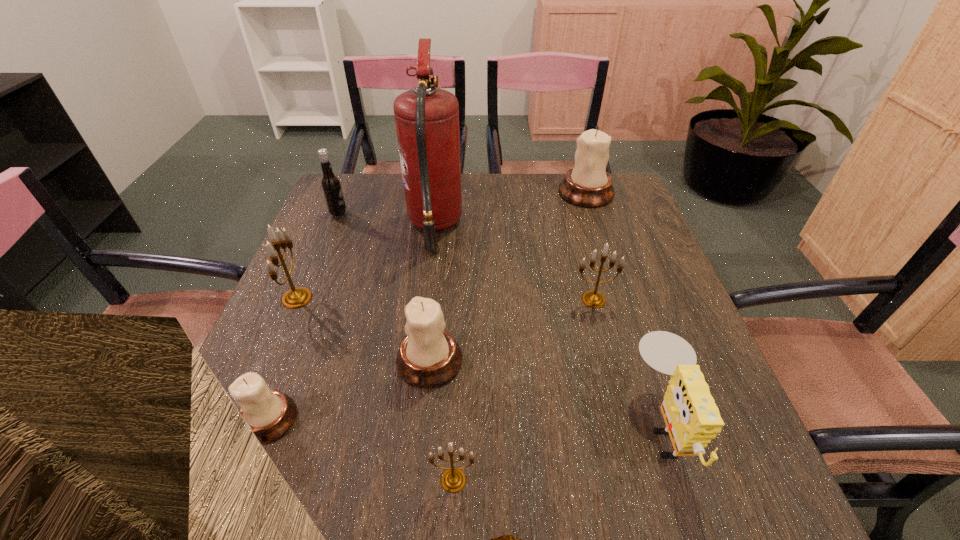
The image size is (960, 540). In order to click on the nearest white candle holder in this screenshot , I will do `click(270, 414)`.

The width and height of the screenshot is (960, 540). Identify the location of the leftmost white candle holder. (270, 414).

Where is `the nearest gold candelabrum`? The image size is (960, 540). the nearest gold candelabrum is located at coordinates (453, 480).

Where is `the second gold candelabrum from right to left`? the second gold candelabrum from right to left is located at coordinates pyautogui.click(x=453, y=480).

What are the coordinates of `vacant region located at the front of the fire extinguisher where the nozzle is aimed` in the screenshot? It's located at (513, 225).

Find the location of a particular element. The height and width of the screenshot is (540, 960). vacant space located 0.070m on the left of the farthest white candle holder is located at coordinates (536, 193).

Find the location of a particular element. The image size is (960, 540). vacant point located on the front of the leftmost gold candelabrum is located at coordinates (210, 503).

Identify the location of vacant region located 0.310m on the label of the root beer. (455, 214).

The image size is (960, 540). Identify the location of vacant area situated 0.130m on the back of the second biggest white candle holder. (437, 292).

Find the location of a particular element. This screenshot has width=960, height=540. blank space located on the back of the second biggest gold candelabrum is located at coordinates (582, 253).